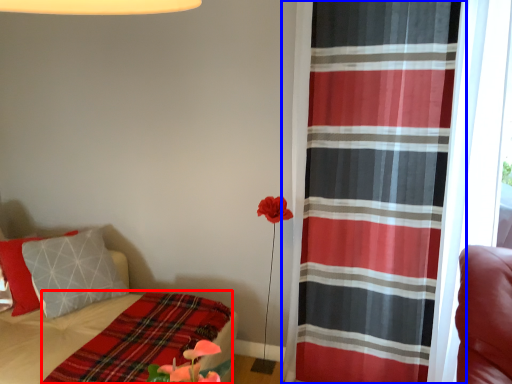
Question: Which object is closer to the camera taking this photo, blanket (highlighted by a red box) or curtain (highlighted by a blue box)?

Choices:
 (A) blanket
 (B) curtain

Answer: (A)